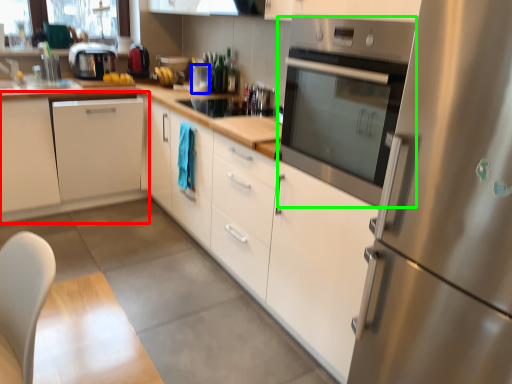
Question: Estimate the real-world distances between objects in this image. Which object is farther from cabinetry (highlighted by a red box), appliance (highlighted by a blue box) or home appliance (highlighted by a green box)?

Choices:
 (A) appliance
 (B) home appliance

Answer: (B)